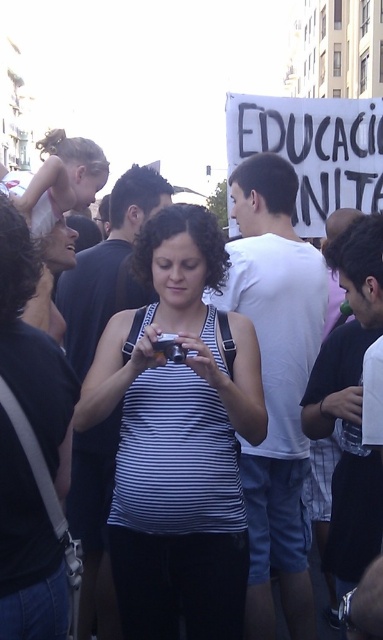
Based on the coordinates provided, which object in the scene is located at point (x=178, y=440)?

The point (x=178, y=440) corresponds to the white striped tank top at center.

You are a photographer at the event and need to determine which clothing item is more suitable for a closeup shot. Considering the sizes of the white striped tank top at center and the white cotton shirt at center, which one would be easier to capture in detail without needing to zoom in too much?

The white striped tank top at center is smaller than the white cotton shirt at center, so the white cotton shirt at center would be easier to capture in detail without needing to zoom in too much because it is larger.

You are a photographer trying to capture a clear shot of the white striped tank top at center from your current position. Given that the camera can focus on objects within 40 meters, will you be able to capture it clearly?

The white striped tank top at center is 40.65 meters from the camera, which is slightly beyond the camera focus range of 40 meters. Therefore, the camera may not be able to focus clearly on the white striped tank top at center.